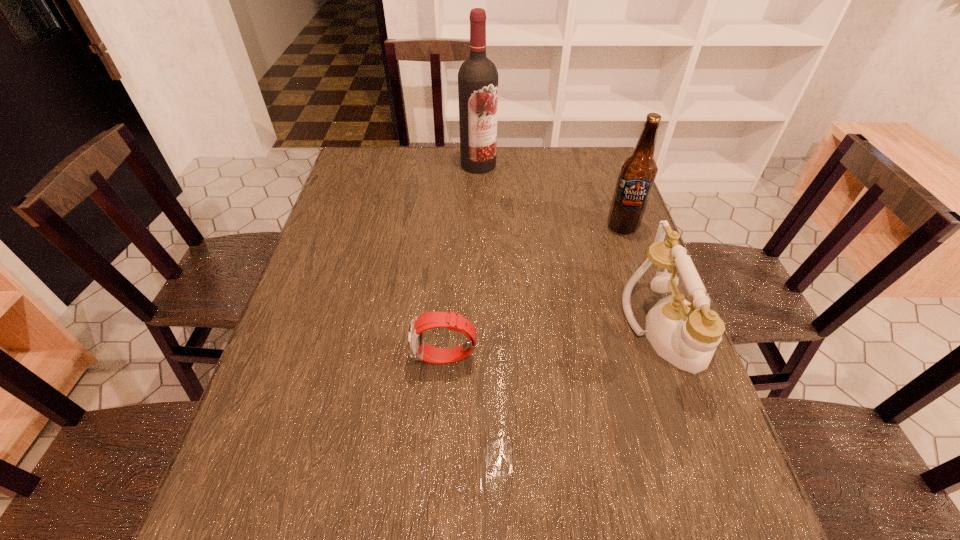
Image resolution: width=960 pixels, height=540 pixels. Identify the location of vacant position at the left edge of the desktop. (311, 253).

This screenshot has height=540, width=960. In order to click on vacant space at the right edge of the desktop in this screenshot , I will do `click(587, 220)`.

The width and height of the screenshot is (960, 540). In the image, there is a desktop. What are the coordinates of `vacant space at the far left corner` in the screenshot? It's located at (381, 163).

This screenshot has height=540, width=960. In the image, there is a desktop. What are the coordinates of `vacant space at the near left corner` in the screenshot? It's located at (266, 432).

Find the location of a particular element. This screenshot has width=960, height=540. free space at the far right corner is located at coordinates (573, 156).

Identify the location of vacant area that lies between the third shortest object and the shortest object. (534, 292).

Find the location of a particular element. free space between the watch and the tallest object is located at coordinates (462, 261).

Locate an element on the screen. free space between the shortest object and the telephone is located at coordinates (556, 343).

The image size is (960, 540). Identify the location of free space between the third tallest object and the farthest object. (573, 247).

I want to click on unoccupied area between the farthest object and the shortest object, so click(462, 261).